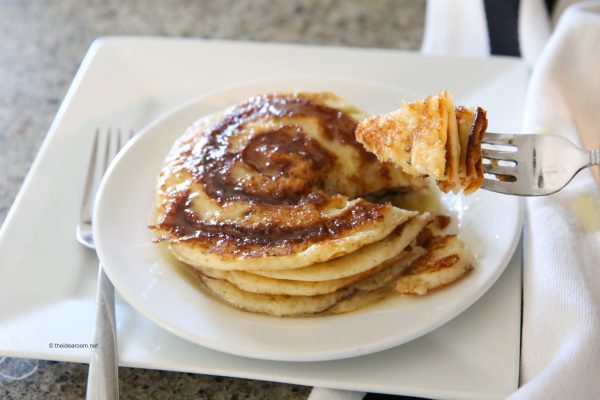
At what (x,y) coordinates should I click in order to perform the action: click on plate. Please return your answer as a coordinate pair (x, y). Looking at the image, I should click on (206, 314), (46, 316).